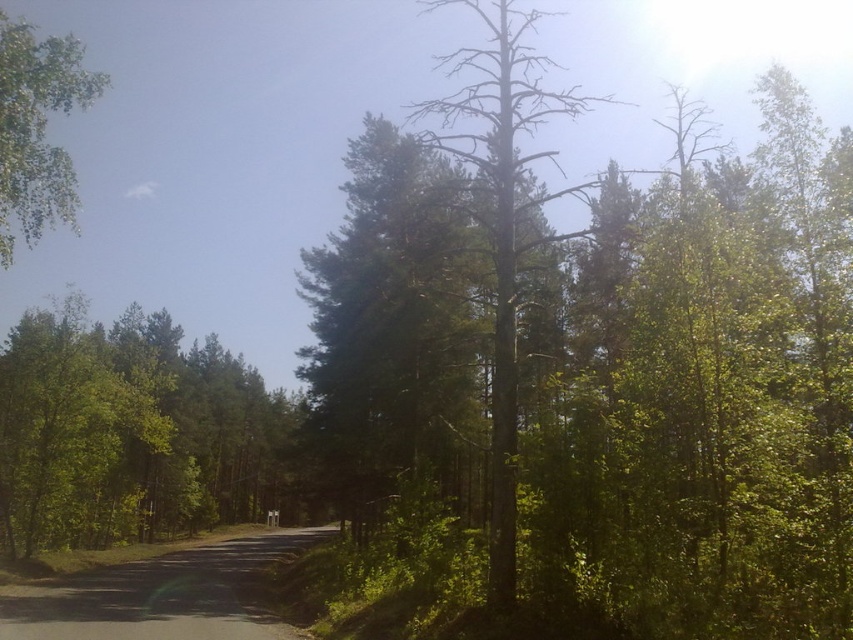
You are driving a car and want to park it on the road. The brown bark tree at center and the green leafy tree at upper left are in your line of sight. Which tree will block your view first if you move forward?

The brown bark tree at center will block your view first because it is in front of the green leafy tree at upper left.

You are standing at the entrance of the forest and see the green leafy tree at center. If you want to walk towards the tree, which direction should you move relative to the road?

The green leafy tree at center is located at point [128,432], which means it is positioned to the right of the road. Therefore, you should move towards the right side of the road to reach the tree.

You are a drone operator trying to capture aerial footage of the forest. You have two points marked in the scene, point [91,362] and point [492,45]. Which point is closer to your camera lens?

Point [91,362] is closer to the camera than point [492,45], so the drone should focus on that point first for clearer footage.